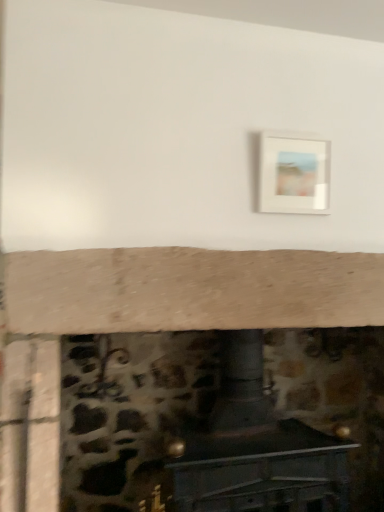
The height and width of the screenshot is (512, 384). Describe the element at coordinates (294, 175) in the screenshot. I see `white matte picture frame at upper right` at that location.

Find the location of a particular element. The height and width of the screenshot is (512, 384). white matte picture frame at upper right is located at coordinates (294, 175).

Find the location of `white matte picture frame at upper right`. white matte picture frame at upper right is located at coordinates (294, 175).